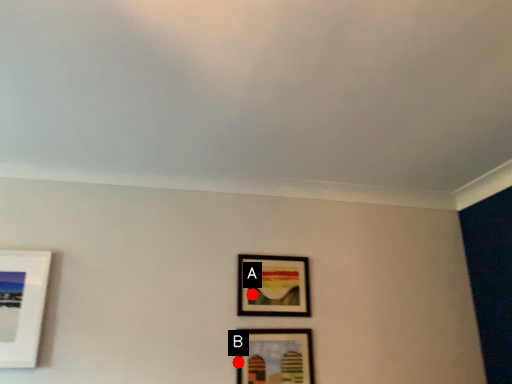
Question: Two points are circled on the image, labeled by A and B beside each circle. Which of the following is the farthest from the observer?

Choices:
 (A) A is further
 (B) B is further

Answer: (A)